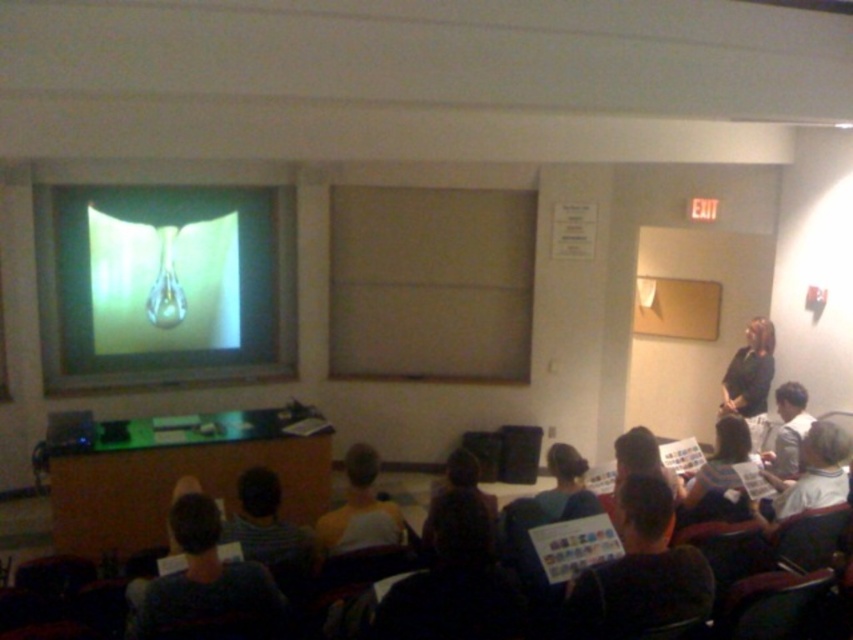
You are a student sitting in the classroom and you see two dark gray clothing items. The dark gray sweater at center and the dark gray shirt at lower left. Which clothing item is narrower?

The dark gray sweater at center is thinner than the dark gray shirt at lower left, so the dark gray sweater at center is narrower.

You are a photographer standing in the back of the classroom. You need to take a photo of both the dark gray shirt at lower left and the yellow shirt at center. Which shirt should you focus on first to ensure both are in frame?

You should focus on the dark gray shirt at lower left first because it is wider than the yellow shirt at center, ensuring both are captured in the frame.

You are a student sitting in the classroom and you see two people in front of you, a dark gray shirt at lower left and a yellow shirt at center. Which person is standing more to your left?

The dark gray shirt at lower left is positioned on the left side of yellow shirt at center, so the dark gray shirt at lower left is more to your left.